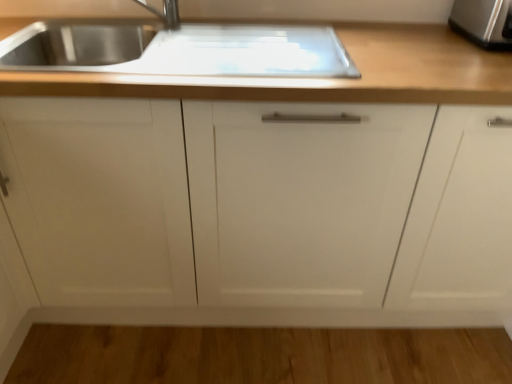
Where is `white matte cabinet at center`? This screenshot has width=512, height=384. white matte cabinet at center is located at coordinates (262, 207).

Identify the location of white matte cabinet at center. The image size is (512, 384). (262, 207).

Is white matte cabinet at center turned away from stainless steel toaster at upper right?

No, stainless steel toaster at upper right is not at the back of white matte cabinet at center.

Which is correct: white matte cabinet at center is inside stainless steel toaster at upper right, or outside of it?

The correct answer is: outside.

Based on the photo, from a real-world perspective, does white matte cabinet at center stand above stainless steel toaster at upper right?

Incorrect, from a real-world perspective, white matte cabinet at center is lower than stainless steel toaster at upper right.

Which is behind, wooden countertop at upper center or white matte cabinet at center?

Positioned behind is wooden countertop at upper center.

Is white matte cabinet at center located within wooden countertop at upper center?

No.

Is wooden countertop at upper center wider or thinner than white matte cabinet at center?

Considering their sizes, wooden countertop at upper center looks slimmer than white matte cabinet at center.

Which object is more forward, stainless steel toaster at upper right or white matte cabinet at center?

white matte cabinet at center.

Which is nearer, (496, 16) or (254, 151)?

The point (254, 151) is closer to the camera.

How much distance is there between stainless steel toaster at upper right and white matte cabinet at center?

stainless steel toaster at upper right is 33.10 inches from white matte cabinet at center.

Is white matte cabinet at center at the back of stainless steel toaster at upper right?

No, stainless steel toaster at upper right's orientation is not away from white matte cabinet at center.

In terms of size, does white matte cabinet at center appear bigger or smaller than wooden countertop at upper center?

Considering their sizes, white matte cabinet at center takes up more space than wooden countertop at upper center.

Between white matte cabinet at center and wooden countertop at upper center, which one appears on the right side from the viewer's perspective?

Positioned to the right is white matte cabinet at center.

Is white matte cabinet at center oriented towards wooden countertop at upper center?

No, white matte cabinet at center is not aimed at wooden countertop at upper center.

Who is more distant, white matte cabinet at center or wooden countertop at upper center?

wooden countertop at upper center is further away from the camera.

How different are the orientations of stainless steel toaster at upper right and wooden countertop at upper center in degrees?

2.01 degrees.

Based on the photo, considering the relative sizes of stainless steel toaster at upper right and wooden countertop at upper center in the image provided, is stainless steel toaster at upper right wider than wooden countertop at upper center?

No, stainless steel toaster at upper right is not wider than wooden countertop at upper center.

Is stainless steel toaster at upper right not within wooden countertop at upper center?

Absolutely, stainless steel toaster at upper right is external to wooden countertop at upper center.

Considering the sizes of objects stainless steel toaster at upper right and wooden countertop at upper center in the image provided, who is bigger, stainless steel toaster at upper right or wooden countertop at upper center?

wooden countertop at upper center.

From a real-world perspective, is wooden countertop at upper center physically above stainless steel toaster at upper right?

No.

Is wooden countertop at upper center located outside stainless steel toaster at upper right?

Yes, wooden countertop at upper center is not within stainless steel toaster at upper right.

Can you tell me how much wooden countertop at upper center and stainless steel toaster at upper right differ in facing direction?

2.01 degrees.

Measure the distance between wooden countertop at upper center and stainless steel toaster at upper right.

wooden countertop at upper center is 35.46 centimeters away from stainless steel toaster at upper right.

At what (x,y) coordinates should I click in order to perform the action: click on stainless steel behind the white matte cabinet at center. Please return your answer as a coordinate pair (x, y). Looking at the image, I should click on (483, 22).

Where is `cabinetry below the wooden countertop at upper center (from the image's perspective)`? Image resolution: width=512 pixels, height=384 pixels. cabinetry below the wooden countertop at upper center (from the image's perspective) is located at coordinates (262, 207).

Based on their spatial positions, is stainless steel toaster at upper right or white matte cabinet at center further from wooden countertop at upper center?

Based on the image, stainless steel toaster at upper right appears to be further to wooden countertop at upper center.

Estimate the real-world distances between objects in this image. Which object is further from white matte cabinet at center, wooden countertop at upper center or stainless steel toaster at upper right?

stainless steel toaster at upper right is further to white matte cabinet at center.

From the image, which object appears to be nearer to white matte cabinet at center, stainless steel toaster at upper right or wooden countertop at upper center?

wooden countertop at upper center is positioned closer to the anchor white matte cabinet at center.

Estimate the real-world distances between objects in this image. Which object is closer to stainless steel toaster at upper right, wooden countertop at upper center or white matte cabinet at center?

wooden countertop at upper center.

When comparing their distances from wooden countertop at upper center, does white matte cabinet at center or stainless steel toaster at upper right seem further?

stainless steel toaster at upper right.

Based on their spatial positions, is white matte cabinet at center or wooden countertop at upper center closer to stainless steel toaster at upper right?

wooden countertop at upper center is positioned closer to the anchor stainless steel toaster at upper right.

Identify the location of cabinetry situated between wooden countertop at upper center and stainless steel toaster at upper right from left to right. This screenshot has width=512, height=384. (262, 207).